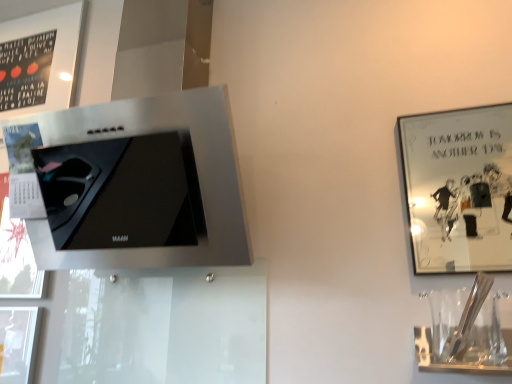
This screenshot has height=384, width=512. Describe the element at coordinates (197, 170) in the screenshot. I see `satin silver range hood at upper left` at that location.

What are the coordinates of `metallic silver picture frame at upper right, which is the second picture frame in left-to-right order` in the screenshot? It's located at (459, 188).

What do you see at coordinates (470, 330) in the screenshot? The width and height of the screenshot is (512, 384). I see `clear glass wine glass at lower right` at bounding box center [470, 330].

What are the coordinates of `matte black frame at upper left, which ranks as the first picture frame in top-to-bottom order` in the screenshot? It's located at click(x=39, y=60).

Is clear glass wine glass at lower right positioned with its back to metallic silver picture frame at upper right, the first picture frame viewed from the right?

No, clear glass wine glass at lower right is not facing away from metallic silver picture frame at upper right, the first picture frame viewed from the right.

This screenshot has height=384, width=512. Find the location of `wine glass in front of the metallic silver picture frame at upper right, the 2th picture frame positioned from the back`. wine glass in front of the metallic silver picture frame at upper right, the 2th picture frame positioned from the back is located at coordinates (470, 330).

Between clear glass wine glass at lower right and metallic silver picture frame at upper right, marked as the 1th picture frame in a bottom-to-top arrangement, which one is positioned in front?

clear glass wine glass at lower right is more forward.

Are clear glass wine glass at lower right and metallic silver picture frame at upper right, the 2th picture frame positioned from the back, beside each other?

No, clear glass wine glass at lower right is not making contact with metallic silver picture frame at upper right, the 2th picture frame positioned from the back.

Based on their positions, is metallic silver picture frame at upper right, the 1th picture frame from the front, located to the left or right of matte black frame at upper left, the 1th picture frame positioned from the back?

Based on their positions, metallic silver picture frame at upper right, the 1th picture frame from the front, is located to the right of matte black frame at upper left, the 1th picture frame positioned from the back.

Which is closer to the camera, (484, 171) or (82, 6)?

Point (484, 171) is farther from the camera than point (82, 6).

From a real-world perspective, who is located lower, metallic silver picture frame at upper right, marked as the 2th picture frame in a top-to-bottom arrangement, or matte black frame at upper left, arranged as the 2th picture frame when viewed from the right?

From a 3D spatial view, metallic silver picture frame at upper right, marked as the 2th picture frame in a top-to-bottom arrangement, is below.

Is metallic silver picture frame at upper right, marked as the 2th picture frame in a top-to-bottom arrangement, positioned in front of matte black frame at upper left, acting as the first picture frame starting from the left?

Yes, it is in front of matte black frame at upper left, acting as the first picture frame starting from the left.

Is metallic silver picture frame at upper right, which is the second picture frame in left-to-right order, looking in the opposite direction of satin silver range hood at upper left?

metallic silver picture frame at upper right, which is the second picture frame in left-to-right order, does not have its back to satin silver range hood at upper left.

Considering the positions of point (445, 200) and point (242, 202), is point (445, 200) closer or farther from the camera than point (242, 202)?

Point (445, 200).

Considering their positions, is metallic silver picture frame at upper right, the 2th picture frame positioned from the back, located in front of or behind satin silver range hood at upper left?

Clearly, metallic silver picture frame at upper right, the 2th picture frame positioned from the back, is behind satin silver range hood at upper left.

Considering the sizes of objects metallic silver picture frame at upper right, marked as the 2th picture frame in a top-to-bottom arrangement, and satin silver range hood at upper left in the image provided, who is shorter, metallic silver picture frame at upper right, marked as the 2th picture frame in a top-to-bottom arrangement, or satin silver range hood at upper left?

metallic silver picture frame at upper right, marked as the 2th picture frame in a top-to-bottom arrangement, is shorter.

Based on the photo, what's the angular difference between matte black frame at upper left, the 1th picture frame positioned from the back, and metallic silver picture frame at upper right, the first picture frame viewed from the right,'s facing directions?

There is a 0.627-degree angle between the facing directions of matte black frame at upper left, the 1th picture frame positioned from the back, and metallic silver picture frame at upper right, the first picture frame viewed from the right.

Is matte black frame at upper left, which is the 2th picture frame in front-to-back order, taller than metallic silver picture frame at upper right, the 2th picture frame positioned from the back?

Indeed, matte black frame at upper left, which is the 2th picture frame in front-to-back order, has a greater height compared to metallic silver picture frame at upper right, the 2th picture frame positioned from the back.

Which object is thinner, matte black frame at upper left, acting as the first picture frame starting from the left, or metallic silver picture frame at upper right, which is the second picture frame in left-to-right order?

With smaller width is matte black frame at upper left, acting as the first picture frame starting from the left.

Who is bigger, matte black frame at upper left, positioned as the second picture frame in bottom-to-top order, or metallic silver picture frame at upper right, marked as the 1th picture frame in a bottom-to-top arrangement?

matte black frame at upper left, positioned as the second picture frame in bottom-to-top order, is bigger.

In order to click on picture frame above the satin silver range hood at upper left (from a real-world perspective) in this screenshot , I will do `click(39, 60)`.

Is matte black frame at upper left, the 1th picture frame positioned from the back, looking in the opposite direction of satin silver range hood at upper left?

No, matte black frame at upper left, the 1th picture frame positioned from the back, is not facing away from satin silver range hood at upper left.

Relative to satin silver range hood at upper left, is matte black frame at upper left, acting as the first picture frame starting from the left, in front or behind?

Clearly, matte black frame at upper left, acting as the first picture frame starting from the left, is behind satin silver range hood at upper left.

How distant is matte black frame at upper left, arranged as the 2th picture frame when viewed from the right, from satin silver range hood at upper left?

matte black frame at upper left, arranged as the 2th picture frame when viewed from the right, and satin silver range hood at upper left are 14.36 inches apart from each other.

Can you confirm if satin silver range hood at upper left is wider than matte black frame at upper left, acting as the first picture frame starting from the left?

Yes.

How much distance is there between satin silver range hood at upper left and matte black frame at upper left, the 1th picture frame positioned from the back?

The distance of satin silver range hood at upper left from matte black frame at upper left, the 1th picture frame positioned from the back, is 14.36 inches.

Can you tell me how much satin silver range hood at upper left and matte black frame at upper left, which is the 2th picture frame in front-to-back order, differ in facing direction?

The facing directions of satin silver range hood at upper left and matte black frame at upper left, which is the 2th picture frame in front-to-back order, are 1.69 degrees apart.

Does point (218, 87) come closer to viewer compared to point (65, 59)?

Yes, it is in front of point (65, 59).

From a real-world perspective, is matte black frame at upper left, acting as the first picture frame starting from the left, positioned above or below clear glass wine glass at lower right?

matte black frame at upper left, acting as the first picture frame starting from the left, is situated higher than clear glass wine glass at lower right in the real world.

Does matte black frame at upper left, which is the 2th picture frame in front-to-back order, appear on the right side of clear glass wine glass at lower right?

Incorrect, matte black frame at upper left, which is the 2th picture frame in front-to-back order, is not on the right side of clear glass wine glass at lower right.

Which is in front, matte black frame at upper left, the 1th picture frame positioned from the back, or clear glass wine glass at lower right?

Positioned in front is clear glass wine glass at lower right.

Identify the location of picture frame to the right of clear glass wine glass at lower right. The image size is (512, 384). (459, 188).

At what (x,y) coordinates should I click in order to perform the action: click on picture frame that is in front of the matte black frame at upper left, acting as the first picture frame starting from the left. Please return your answer as a coordinate pair (x, y). The width and height of the screenshot is (512, 384). Looking at the image, I should click on (459, 188).

Looking at the image, which one is located further to matte black frame at upper left, acting as the first picture frame starting from the left, satin silver range hood at upper left or metallic silver picture frame at upper right, the 1th picture frame from the front?

The object further to matte black frame at upper left, acting as the first picture frame starting from the left, is metallic silver picture frame at upper right, the 1th picture frame from the front.

From the image, which object appears to be farther from satin silver range hood at upper left, clear glass wine glass at lower right or matte black frame at upper left, acting as the first picture frame starting from the left?

clear glass wine glass at lower right is further to satin silver range hood at upper left.

When comparing their distances from matte black frame at upper left, arranged as the 2th picture frame when viewed from the right, does satin silver range hood at upper left or clear glass wine glass at lower right seem closer?

The object closer to matte black frame at upper left, arranged as the 2th picture frame when viewed from the right, is satin silver range hood at upper left.

Considering their positions, is matte black frame at upper left, which is the 2th picture frame in front-to-back order, positioned further to clear glass wine glass at lower right than satin silver range hood at upper left?

matte black frame at upper left, which is the 2th picture frame in front-to-back order, is positioned further to the anchor clear glass wine glass at lower right.

In the scene shown: From the image, which object appears to be nearer to matte black frame at upper left, acting as the first picture frame starting from the left, clear glass wine glass at lower right or satin silver range hood at upper left?

satin silver range hood at upper left lies closer to matte black frame at upper left, acting as the first picture frame starting from the left, than the other object.

Looking at the image, which one is located further to clear glass wine glass at lower right, satin silver range hood at upper left or metallic silver picture frame at upper right, which is the second picture frame in left-to-right order?

Based on the image, metallic silver picture frame at upper right, which is the second picture frame in left-to-right order, appears to be further to clear glass wine glass at lower right.

Which object lies further to the anchor point satin silver range hood at upper left, matte black frame at upper left, acting as the first picture frame starting from the left, or clear glass wine glass at lower right?

clear glass wine glass at lower right.

Looking at the image, which one is located closer to metallic silver picture frame at upper right, the 2th picture frame positioned from the back, clear glass wine glass at lower right or satin silver range hood at upper left?

The object closer to metallic silver picture frame at upper right, the 2th picture frame positioned from the back, is clear glass wine glass at lower right.

Locate an element on the screen. wine glass between matte black frame at upper left, the 1th picture frame positioned from the back, and metallic silver picture frame at upper right, marked as the 2th picture frame in a top-to-bottom arrangement is located at coordinates (470, 330).

Locate an element on the screen. appliance between matte black frame at upper left, which ranks as the first picture frame in top-to-bottom order, and clear glass wine glass at lower right, in the horizontal direction is located at coordinates (197, 170).

At what (x,y) coordinates should I click in order to perform the action: click on appliance between matte black frame at upper left, which ranks as the first picture frame in top-to-bottom order, and metallic silver picture frame at upper right, the 1th picture frame from the front, from left to right. Please return your answer as a coordinate pair (x, y). Looking at the image, I should click on (197, 170).

This screenshot has height=384, width=512. Identify the location of wine glass between satin silver range hood at upper left and metallic silver picture frame at upper right, the first picture frame viewed from the right. (470, 330).